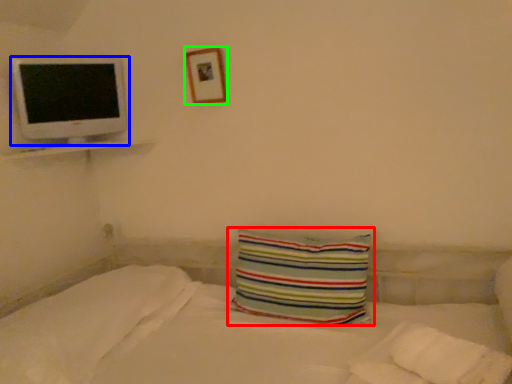
Question: Which object is the closest to the pillow (highlighted by a red box)? Choose among these: computer monitor (highlighted by a blue box) or picture frame (highlighted by a green box).

Choices:
 (A) computer monitor
 (B) picture frame

Answer: (B)